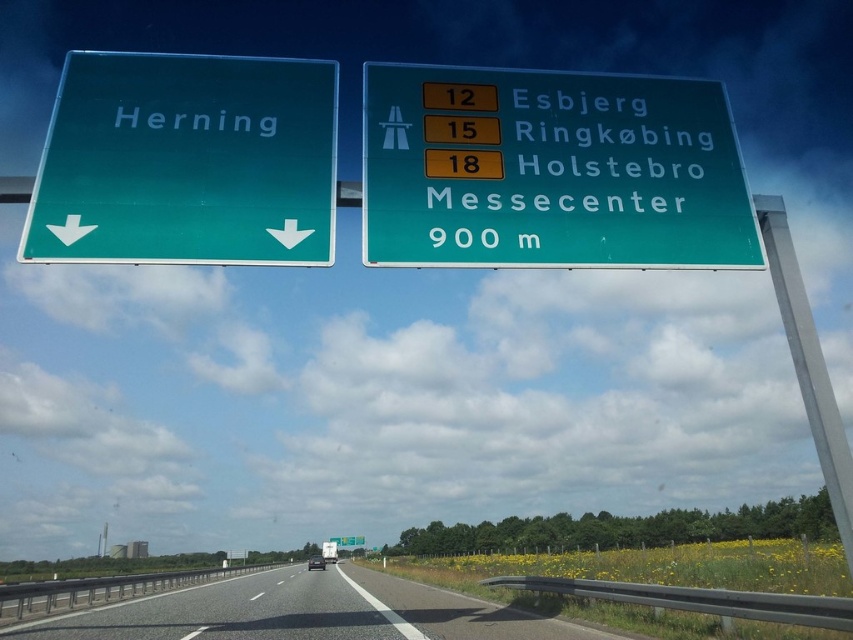
From the picture: Is green glossy signboard at upper center thinner than asphalt road at center?

Yes, green glossy signboard at upper center is thinner than asphalt road at center.

Describe the element at coordinates (550, 170) in the screenshot. I see `green glossy signboard at upper center` at that location.

Who is more forward, (432, 168) or (532, 636)?

Positioned in front is point (432, 168).

Where is `green glossy signboard at upper center`? The height and width of the screenshot is (640, 853). green glossy signboard at upper center is located at coordinates (550, 170).

Who is more forward, (155, 60) or (427, 611)?

Point (155, 60) is in front.

Is green glossy sign at left to the right of asphalt road at center from the viewer's perspective?

Indeed, green glossy sign at left is positioned on the right side of asphalt road at center.

Find the location of a particular element. green glossy sign at left is located at coordinates (186, 161).

Which is above, green glossy signboard at upper center or green glossy sign at left?

green glossy signboard at upper center

Image resolution: width=853 pixels, height=640 pixels. What are the coordinates of `green glossy signboard at upper center` in the screenshot? It's located at (550, 170).